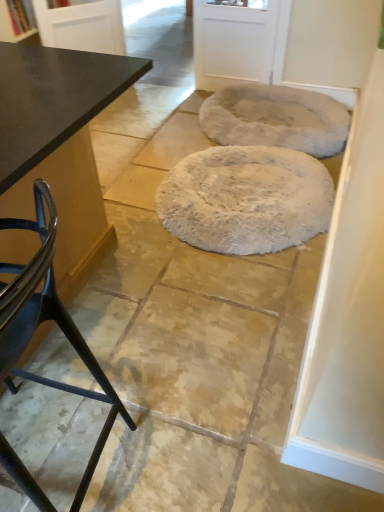
Find the location of a particular element. This screenshot has height=512, width=384. free area in between white fluffy rug at center, acting as the second mat starting from the back, and black matte table at left is located at coordinates (179, 278).